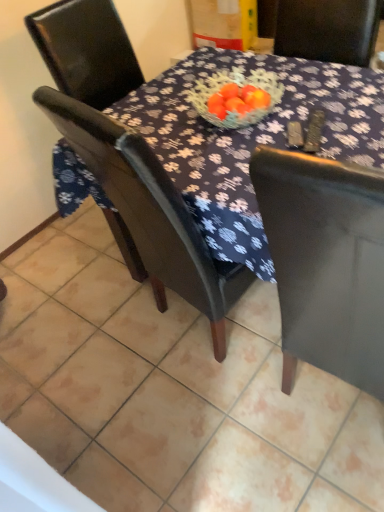
Question: Is the depth of matte black chair at left, marked as the first chair in a top-to-bottom arrangement, less than that of matte black chair at center?

Choices:
 (A) yes
 (B) no

Answer: (B)

Question: Is matte black chair at left, the 2th chair in the bottom-to-top sequence, far away from matte black chair at center?

Choices:
 (A) yes
 (B) no

Answer: (A)

Question: Can you confirm if matte black chair at left, marked as the first chair in a top-to-bottom arrangement, is bigger than matte black chair at center?

Choices:
 (A) no
 (B) yes

Answer: (A)

Question: From the image's perspective, is matte black chair at left, marked as the first chair in a top-to-bottom arrangement, under matte black chair at center?

Choices:
 (A) yes
 (B) no

Answer: (B)

Question: Is matte black chair at left, marked as the first chair in a top-to-bottom arrangement, facing towards matte black chair at center?

Choices:
 (A) no
 (B) yes

Answer: (A)

Question: In the image, is matte black chair at left, the 2th chair in the bottom-to-top sequence, on the left side or the right side of matte black chair at center?

Choices:
 (A) right
 (B) left

Answer: (B)

Question: From a real-world perspective, relative to matte black chair at center, is matte black chair at left, marked as the first chair in a top-to-bottom arrangement, vertically above or below?

Choices:
 (A) above
 (B) below

Answer: (A)

Question: Relative to matte black chair at center, is matte black chair at left, the 2th chair in the bottom-to-top sequence, in front or behind?

Choices:
 (A) behind
 (B) front

Answer: (A)

Question: Is point (107, 101) positioned closer to the camera than point (119, 428)?

Choices:
 (A) closer
 (B) farther

Answer: (B)

Question: From the image's perspective, relative to matte black chair at center, the second chair when ordered from top to bottom, is matte black chair at center above or below?

Choices:
 (A) above
 (B) below

Answer: (A)

Question: Considering the positions of matte black chair at center and matte black chair at center, the second chair when ordered from top to bottom, in the image, is matte black chair at center bigger or smaller than matte black chair at center, the second chair when ordered from top to bottom,?

Choices:
 (A) small
 (B) big

Answer: (B)

Question: Is matte black chair at center in front of or behind matte black chair at center, the second chair when ordered from top to bottom, in the image?

Choices:
 (A) front
 (B) behind

Answer: (B)

Question: In the image, is matte black chair at center on the left side or the right side of matte black chair at center, marked as the 1th chair in a bottom-to-top arrangement?

Choices:
 (A) right
 (B) left

Answer: (A)

Question: Considering the positions of matte black chair at center and matte black chair at left, the 2th chair in the bottom-to-top sequence, in the image, is matte black chair at center wider or thinner than matte black chair at left, the 2th chair in the bottom-to-top sequence,?

Choices:
 (A) thin
 (B) wide

Answer: (B)

Question: Based on their sizes in the image, would you say matte black chair at center is bigger or smaller than matte black chair at left, marked as the first chair in a top-to-bottom arrangement?

Choices:
 (A) small
 (B) big

Answer: (B)